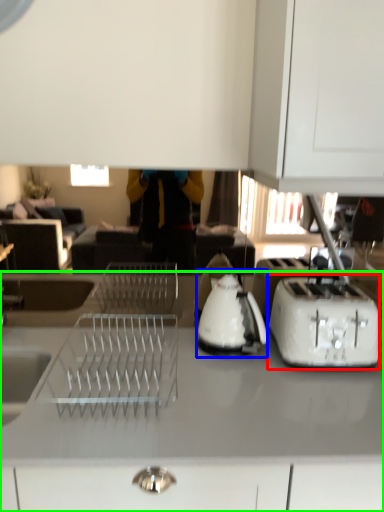
Question: Based on their relative distances, which object is nearer to toaster (highlighted by a red box)? Choose from kettle (highlighted by a blue box) and countertop (highlighted by a green box).

Choices:
 (A) kettle
 (B) countertop

Answer: (A)